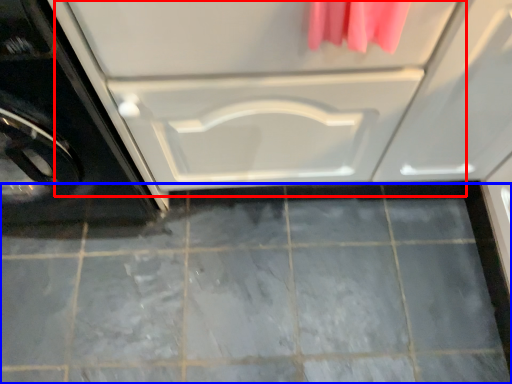
Question: Which point is further to the camera, drawer (highlighted by a red box) or ceramic tile (highlighted by a blue box)?

Choices:
 (A) drawer
 (B) ceramic tile

Answer: (B)